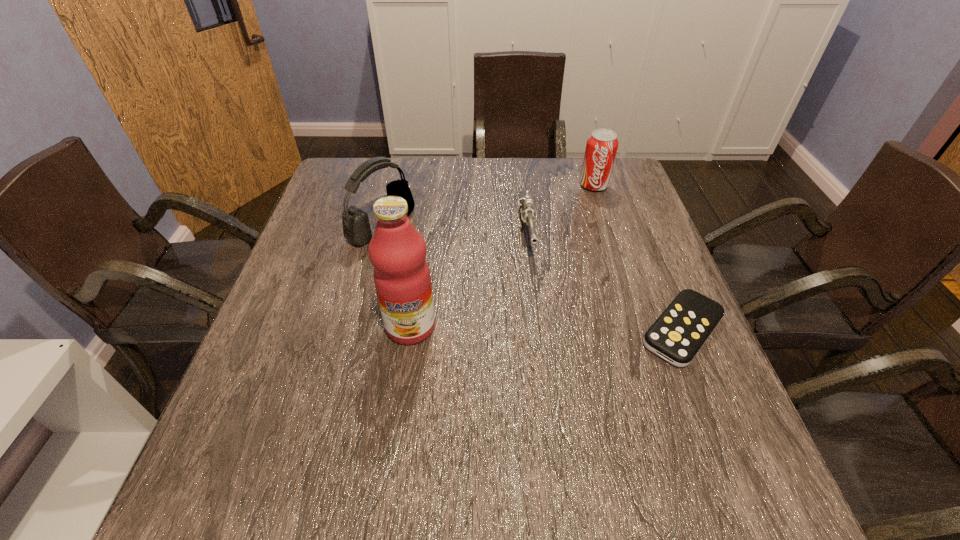
Identify the location of the tallest object. The width and height of the screenshot is (960, 540). (397, 251).

Find the location of a particular element. The width and height of the screenshot is (960, 540). the shortest object is located at coordinates (678, 334).

Find the location of a particular element. Image resolution: width=960 pixels, height=540 pixels. the farthest object is located at coordinates (601, 148).

Identify the location of soda can. (601, 148).

I want to click on headset, so click(x=356, y=227).

This screenshot has width=960, height=540. In order to click on gun in this screenshot , I will do `click(525, 206)`.

Where is `the second shortest object`? The width and height of the screenshot is (960, 540). the second shortest object is located at coordinates (525, 206).

Where is `free spot located 0.080m on the label of the tallest object`? free spot located 0.080m on the label of the tallest object is located at coordinates (403, 381).

Identify the location of vacant space located on the left of the remote control. Image resolution: width=960 pixels, height=540 pixels. (455, 330).

I want to click on vacant space situated on the logo side of the farthest object, so click(x=589, y=224).